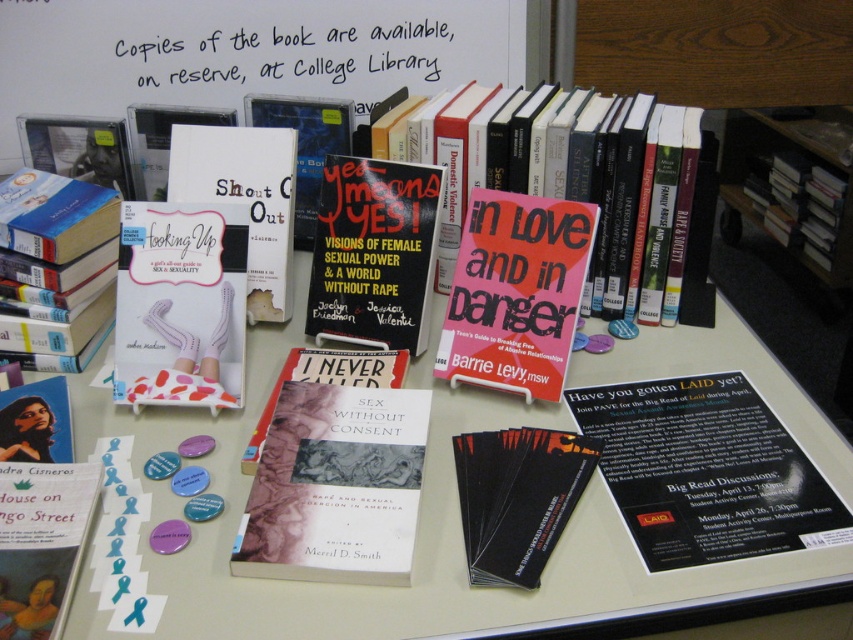
Question: Is the position of black paper poster at lower right less distant than that of matte pink cover at center?

Choices:
 (A) yes
 (B) no

Answer: (A)

Question: Which is nearer to the matte gray book at center?

Choices:
 (A) white paper at upper center
 (B) matte white book at left
 (C) hardcover book at lower left

Answer: (C)

Question: Which of the following is the farthest from the observer?

Choices:
 (A) [x=541, y=250]
 (B) [x=199, y=301]
 (C) [x=27, y=184]

Answer: (C)

Question: Which of the following is the closest to the observer?

Choices:
 (A) black matte business cards at center
 (B) black matte book at center

Answer: (A)

Question: Is white paper at upper center to the right of hardcover book at lower left from the viewer's perspective?

Choices:
 (A) yes
 (B) no

Answer: (A)

Question: Can you confirm if matte gray book at center is wider than black matte book at center?

Choices:
 (A) yes
 (B) no

Answer: (B)